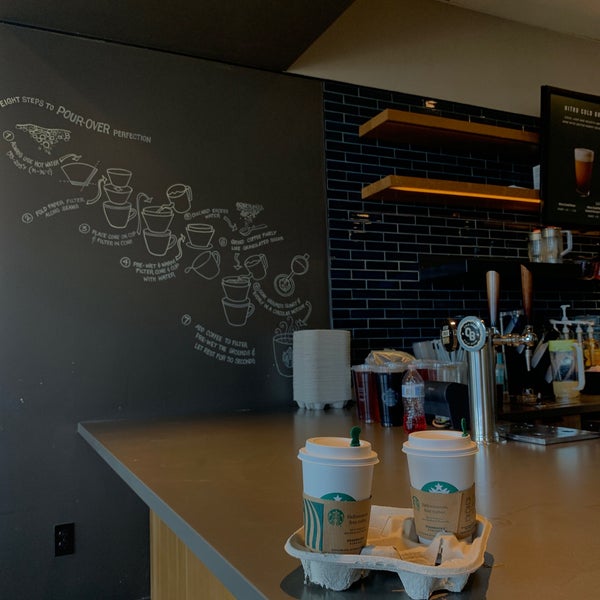
At what (x,y) coordinates should I click in order to perform the action: click on cardboard cup wrap. Please return your answer as a coordinate pair (x, y). The height and width of the screenshot is (600, 600). Looking at the image, I should click on (326, 517), (433, 495).